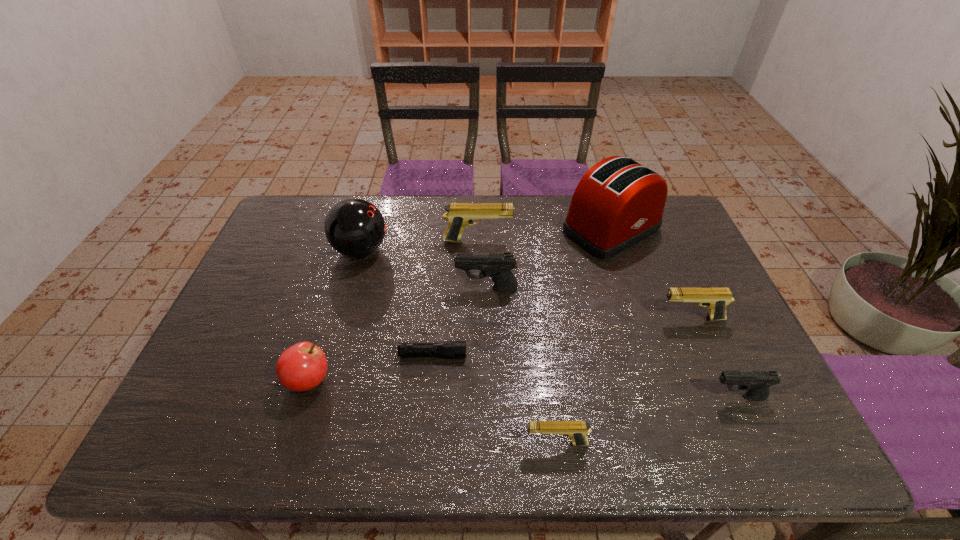
You are a GUI agent. You are given a task and a screenshot of the screen. Output one action in this format:
    pyautogui.click(x=<x>, y=<y>)
    Task: Click on the toaster
    
    Given the screenshot: What is the action you would take?
    pyautogui.click(x=618, y=202)

Find the location of `red toaster`. red toaster is located at coordinates (618, 202).

Find the location of a particular element. The image size is (960, 540). bowling ball is located at coordinates (354, 227).

Locate an element on the screen. the eighth shortest object is located at coordinates (354, 227).

Locate an element on the screen. The image size is (960, 540). the farthest tan pistol is located at coordinates point(459,215).

At what (x,y) coordinates should I click in order to perform the action: click on the farthest pistol. Please return your answer as a coordinate pair (x, y). The width and height of the screenshot is (960, 540). Looking at the image, I should click on (459, 215).

Locate an element on the screen. Image resolution: width=960 pixels, height=540 pixels. the fourth nearest pistol is located at coordinates (498, 266).

Image resolution: width=960 pixels, height=540 pixels. I want to click on the bigger black pistol, so click(498, 266).

Image resolution: width=960 pixels, height=540 pixels. Identify the location of the third farthest pistol. (716, 300).

This screenshot has width=960, height=540. I want to click on the fifth farthest object, so click(716, 300).